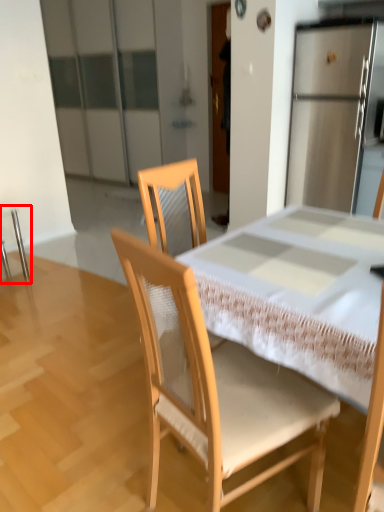
Question: Where is chair (annotated by the red box) located in relation to chair in the image?

Choices:
 (A) right
 (B) left

Answer: (B)